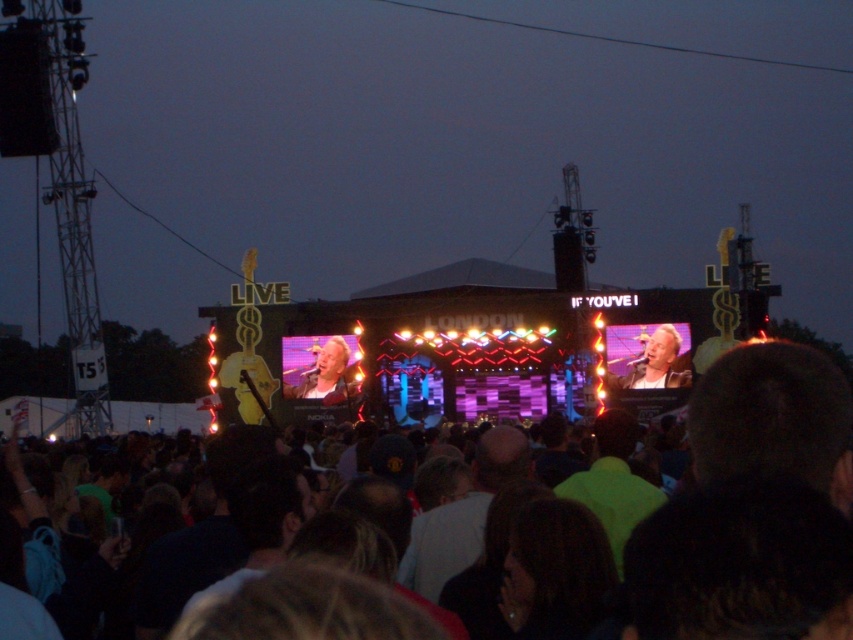
You are a photographer at the concert and want to capture both the matte black jacket at center and the light brown leather jacket at center in a single frame. Which jacket should you focus on first to ensure both are in the shot?

You should focus on the light brown leather jacket at center first because the matte black jacket at center is to the right of it, so by centering the light brown one, the matte black one will naturally be included in the frame to its right.